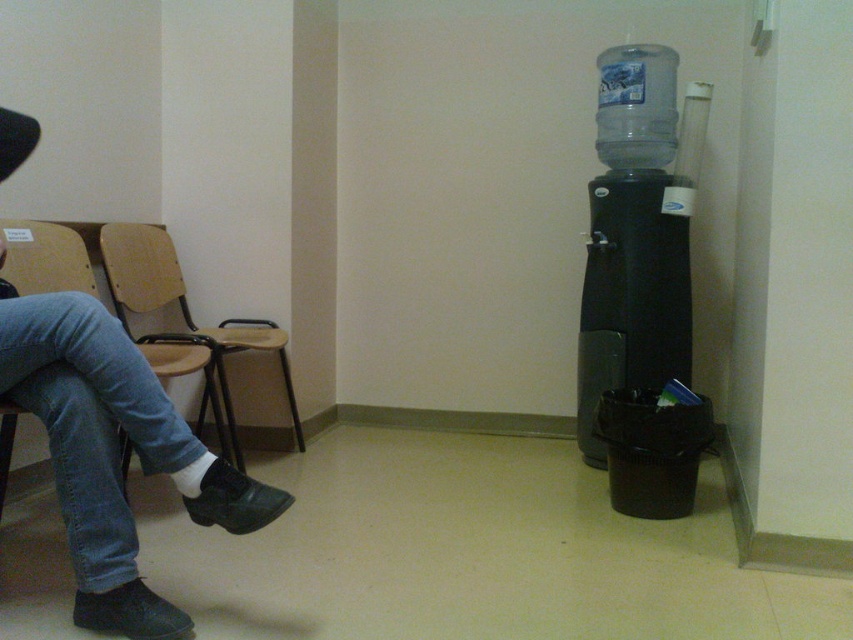
You are a delivery person who just arrived at the office. You see the denim jeans at left and the clear plastic bottle at right. Which object is taller?

The denim jeans at left has a greater height compared to the clear plastic bottle at right, so the denim jeans at left is taller.

You are a service robot in the waiting area. You need to deliver a package to the person sitting on the wooden chair. The package is placed at the water dispenser on the right. Can you reach the person without moving the denim jeans at left?

The denim jeans at left is located at point (113, 452). Since the jeans are part of the person sitting on the chair, you cannot move them. Therefore, you must navigate around the jeans to deliver the package.